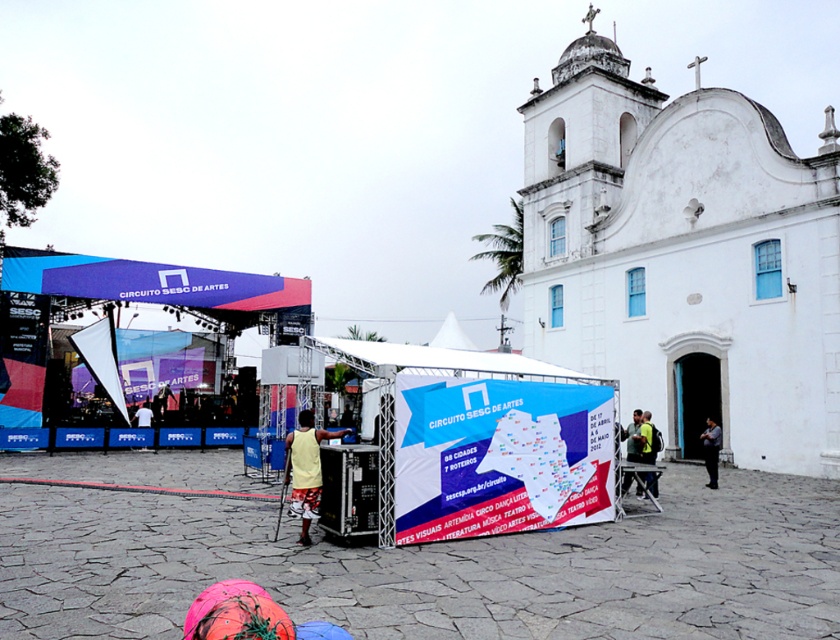
Question: Estimate the real-world distances between objects in this image. Which object is farther from the white fabric canopy at center?

Choices:
 (A) yellow-green fabric jacket at center-right
 (B) green fabric bag at center

Answer: (A)

Question: Does matte blue banner at center appear on the left side of dark gray fabric shirt at center?

Choices:
 (A) yes
 (B) no

Answer: (A)

Question: Does white stone church at center have a larger size compared to matte blue banner at center?

Choices:
 (A) yes
 (B) no

Answer: (A)

Question: Which of the following is the closest to the observer?

Choices:
 (A) white stone church at center
 (B) yellow-green fabric jacket at center-right
 (C) white fabric shirt at center
 (D) dark gray fabric shirt at center

Answer: (B)

Question: Which point is closer to the camera taking this photo?

Choices:
 (A) (638, 492)
 (B) (657, 314)
 (C) (347, 358)
 (D) (82, 269)

Answer: (C)

Question: Does yellow-green fabric jacket at center-right lie behind white fabric shirt at center?

Choices:
 (A) yes
 (B) no

Answer: (B)